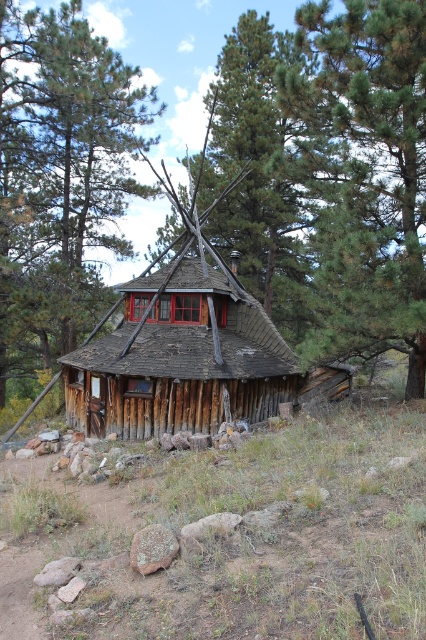
Looking at this image, you are standing in the clearing in front of the cabin and want to take a photo of both the green textured pine trees at upper center and the brown wooden cabin at center. Which object should you focus on first if you want to capture both in the same frame without moving the camera?

The green textured pine trees at upper center are above the brown wooden cabin at center, so you should focus on the brown wooden cabin at center first to ensure both are in the frame.

You are standing in front of the rustic wooden cabin and want to take a photo of the green textured pine trees at upper center. Based on their position, where should you aim your camera?

The green textured pine trees at upper center are located at point 0.273 on the horizontal axis and 0.770 on the vertical axis, so you should aim your camera towards the upper center area of the scene to capture them.